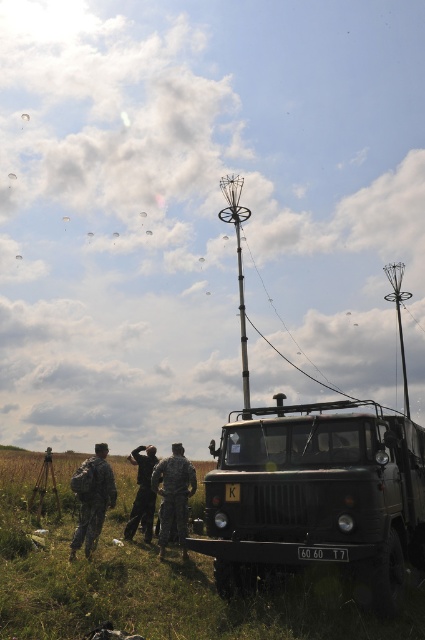
Is camouflage fabric uniform at lower left thinner than camouflage fabric uniform at center?

Correct, camouflage fabric uniform at lower left's width is less than camouflage fabric uniform at center's.

Is camouflage fabric uniform at lower left in front of camouflage fabric uniform at center?

That is True.

Between point (112, 506) and point (172, 448), which one is positioned behind?

The point (172, 448) is more distant.

Locate an element on the screen. The image size is (425, 640). camouflage fabric uniform at lower left is located at coordinates (93, 499).

Looking at this image, is camouflage fabric uniform at lower left behind camouflage uniform at center?

No, camouflage fabric uniform at lower left is closer to the viewer.

Is point (102, 515) positioned behind point (156, 460)?

No.

Who is more distant from viewer, (90,556) or (147,481)?

Positioned behind is point (147,481).

Image resolution: width=425 pixels, height=640 pixels. I want to click on camouflage fabric uniform at lower left, so click(x=93, y=499).

Image resolution: width=425 pixels, height=640 pixels. What do you see at coordinates (156, 579) in the screenshot?
I see `green grassy field at lower center` at bounding box center [156, 579].

Is point (363, 625) farther from viewer compared to point (408, 449)?

No, (363, 625) is in front of (408, 449).

Identify the location of green grassy field at lower center. This screenshot has height=640, width=425. (156, 579).